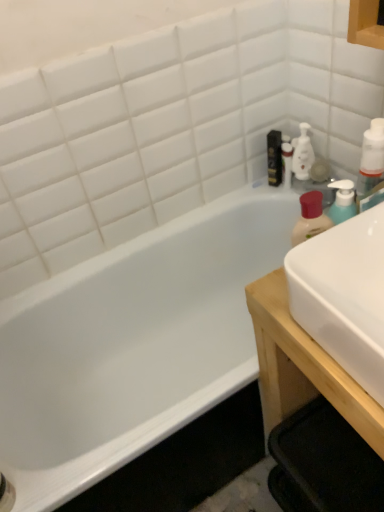
Question: Would you say white glossy sink at right is inside or outside white plastic bottle at upper right?

Choices:
 (A) inside
 (B) outside

Answer: (B)

Question: Considering the positions of white glossy sink at right and white plastic bottle at upper right in the image, is white glossy sink at right wider or thinner than white plastic bottle at upper right?

Choices:
 (A) wide
 (B) thin

Answer: (A)

Question: Which is nearer to the white glossy bottle at upper right?

Choices:
 (A) white wood table at right
 (B) white glossy bathtub at left
 (C) white glossy sink at right
 (D) black glossy bottle at upper right
 (E) white plastic bottle at upper right

Answer: (D)

Question: Based on their relative distances, which object is farther from the white plastic bottle at upper right?

Choices:
 (A) white glossy sink at right
 (B) translucent plastic bottle at upper right
 (C) white wood table at right
 (D) white glossy bottle at upper right
 (E) black glossy bottle at upper right

Answer: (E)